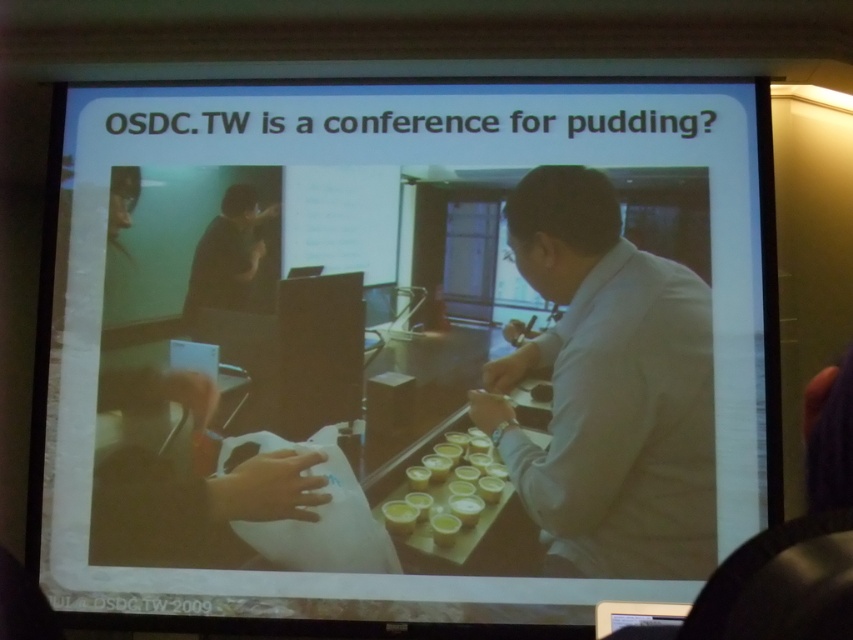
Between white shirt at center and white matte paper at lower left, which one is positioned higher?

Positioned higher is white shirt at center.

Which is in front, point (666, 307) or point (194, 387)?

Point (666, 307) is more forward.

What do you see at coordinates (608, 388) in the screenshot?
I see `white shirt at center` at bounding box center [608, 388].

You are a GUI agent. You are given a task and a screenshot of the screen. Output one action in this format:
    pyautogui.click(x=<x>, y=<y>)
    Task: Click on the white shirt at center
    The width and height of the screenshot is (853, 640).
    Given the screenshot: What is the action you would take?
    pyautogui.click(x=608, y=388)

Can you confirm if white paper at center is bigger than white shirt at center?

Yes.

Between point (175, 465) and point (566, 198), which one is positioned behind?

The point (566, 198) is behind.

The width and height of the screenshot is (853, 640). Identify the location of white paper at center. (410, 340).

Does white matte paper at lower left appear on the right side of yellow matte pudding at center?

Incorrect, white matte paper at lower left is not on the right side of yellow matte pudding at center.

Does white matte paper at lower left lie behind yellow matte pudding at center?

Yes.

Where is `white matte paper at lower left`? Image resolution: width=853 pixels, height=640 pixels. white matte paper at lower left is located at coordinates (184, 483).

Where is `white matte paper at lower left`? Image resolution: width=853 pixels, height=640 pixels. white matte paper at lower left is located at coordinates (184, 483).